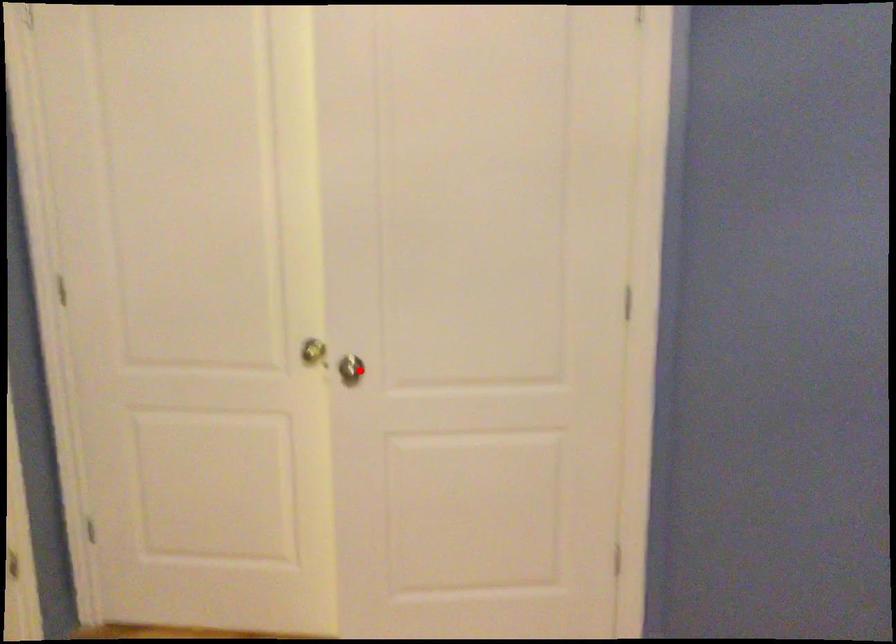
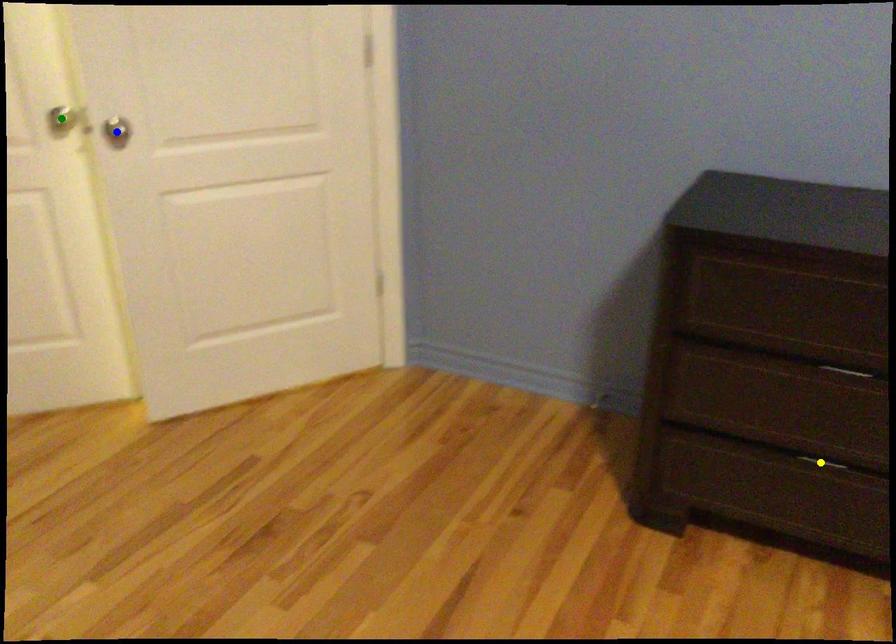
Question: I am providing you with two images of the same scene from different viewpoints. A red point is marked on the first image. You are given multiple points on the second image. Which spot in image 2 lines up with the point in image 1?

Choices:
 (A) yellow point
 (B) blue point
 (C) green point

Answer: (B)